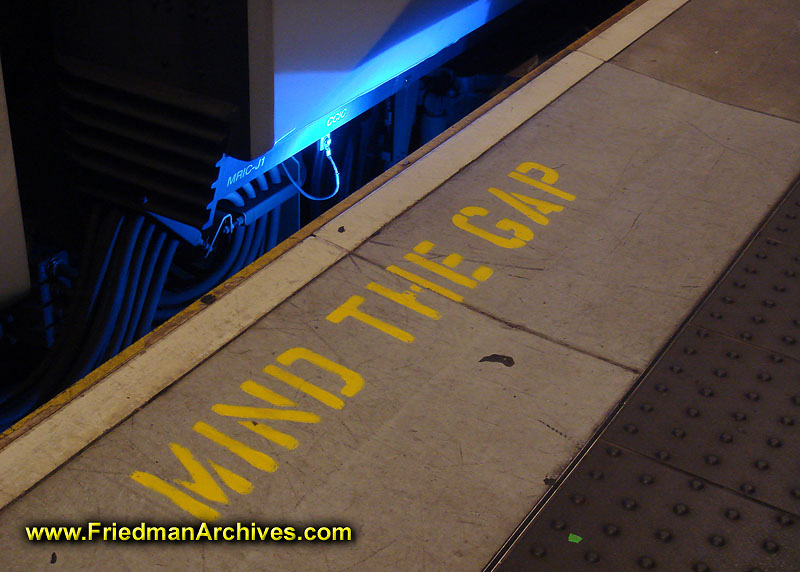
Locate an element on the screen. The image size is (800, 572). blue counter top is located at coordinates (334, 95).